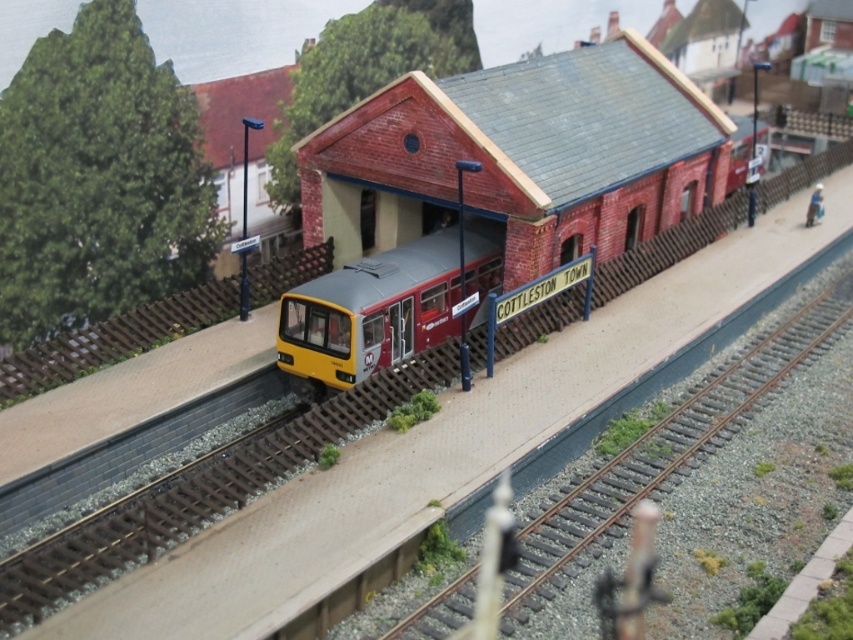
Which is in front, point (759, 371) or point (328, 312)?

Point (328, 312) is more forward.

Between metallic brown train track at center and yellow matte passenger train at center, which one has more height?

Standing taller between the two is metallic brown train track at center.

This screenshot has width=853, height=640. Describe the element at coordinates (666, 451) in the screenshot. I see `metallic brown train track at center` at that location.

Identify the location of metallic brown train track at center. (666, 451).